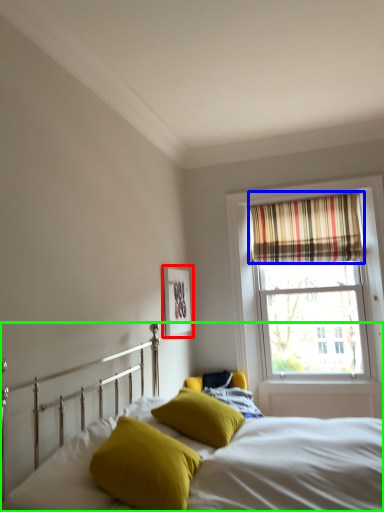
Question: Which is nearer to the picture frame (highlighted by a red box)? curtain (highlighted by a blue box) or bed (highlighted by a green box).

Choices:
 (A) curtain
 (B) bed

Answer: (A)